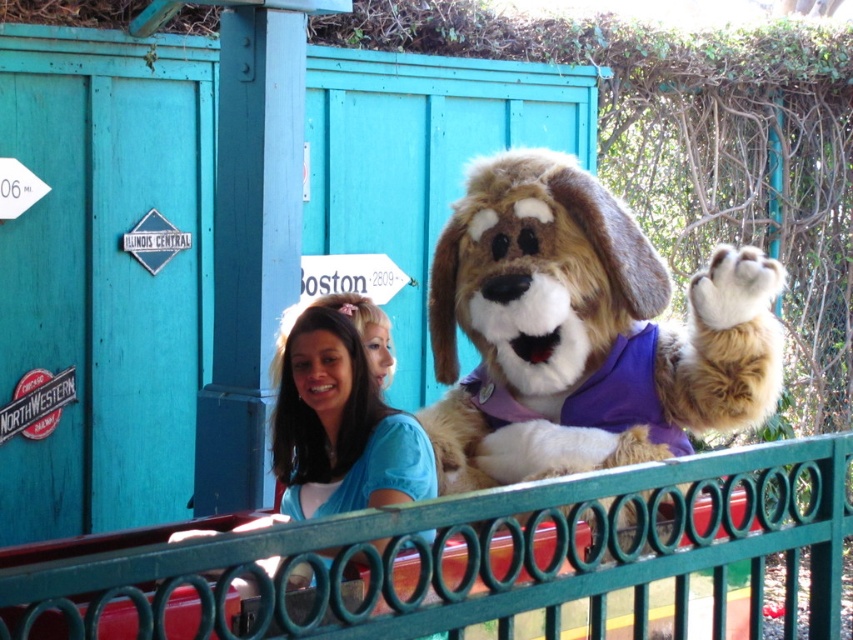
Question: Which of the following is the farthest from the observer?

Choices:
 (A) fluffy brown dog at center
 (B) green metal fence at center

Answer: (A)

Question: Which point is closer to the camera?

Choices:
 (A) (560, 221)
 (B) (509, 528)

Answer: (B)

Question: Does green metal fence at center come in front of fluffy brown dog at center?

Choices:
 (A) no
 (B) yes

Answer: (B)

Question: Is green metal fence at center further to the viewer compared to fluffy brown dog at center?

Choices:
 (A) yes
 (B) no

Answer: (B)

Question: Does green metal fence at center have a larger size compared to fluffy brown dog at center?

Choices:
 (A) no
 (B) yes

Answer: (B)